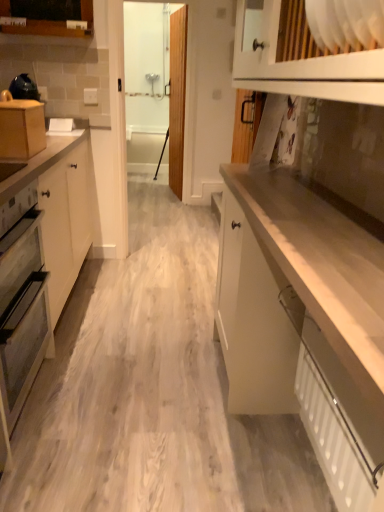
Locate an element on the screen. matte wood box at left, which is the second cabinetry in left-to-right order is located at coordinates (21, 129).

Find the location of a particular element. transparent glass door at upper center is located at coordinates (176, 95).

Identify the location of matte wood box at left, which is counted as the second cabinetry, starting from the right. Image resolution: width=384 pixels, height=512 pixels. (21, 129).

Is point (335, 329) farther from camera compared to point (14, 322)?

That is False.

Is white matte cabinet at center, positioned as the third cabinetry in left-to-right order, taller or shorter than matte gray oven at left?

In the image, white matte cabinet at center, positioned as the third cabinetry in left-to-right order, appears to be shorter than matte gray oven at left.

Can you tell me how much white matte cabinet at center, positioned as the first cabinetry in front-to-back order, and matte gray oven at left differ in facing direction?

They differ by 180 degrees in their facing directions.

From a real-world perspective, is white matte cabinet at center, the 3th cabinetry viewed from the back, physically above white textured radiator at lower right?

Yes, from a real-world perspective, white matte cabinet at center, the 3th cabinetry viewed from the back, is above white textured radiator at lower right.

Would you say white matte cabinet at center, the 3th cabinetry from the top, is to the left or to the right of white textured radiator at lower right in the picture?

white matte cabinet at center, the 3th cabinetry from the top, is to the left of white textured radiator at lower right.

Locate an element on the screen. radiator that appears below the white matte cabinet at center, positioned as the first cabinetry in front-to-back order (from a real-world perspective) is located at coordinates (338, 435).

Is white matte cabinet at center, the 3th cabinetry viewed from the back, at the left side of wooden cabinet at upper left, which is the 1th cabinetry from top to bottom?

Incorrect, white matte cabinet at center, the 3th cabinetry viewed from the back, is not on the left side of wooden cabinet at upper left, which is the 1th cabinetry from top to bottom.

Which object is wider, white matte cabinet at center, marked as the 1th cabinetry in a bottom-to-top arrangement, or wooden cabinet at upper left, the first cabinetry from the left?

With larger width is white matte cabinet at center, marked as the 1th cabinetry in a bottom-to-top arrangement.

Could you measure the distance between white matte cabinet at center, the first cabinetry in the right-to-left sequence, and wooden cabinet at upper left, the first cabinetry from the left?

A distance of 6.48 feet exists between white matte cabinet at center, the first cabinetry in the right-to-left sequence, and wooden cabinet at upper left, the first cabinetry from the left.

How different are the orientations of white textured radiator at lower right and wooden cabinet at upper left, which is the 1th cabinetry from top to bottom, in degrees?

white textured radiator at lower right and wooden cabinet at upper left, which is the 1th cabinetry from top to bottom, are facing 88.2 degrees away from each other.

From a real-world perspective, which object stands above the other?

wooden cabinet at upper left, the first cabinetry from the left, is physically above.

Is white textured radiator at lower right turned away from wooden cabinet at upper left, which is counted as the third cabinetry, starting from the right?

No, white textured radiator at lower right is not facing the opposite direction of wooden cabinet at upper left, which is counted as the third cabinetry, starting from the right.

Where is `the 3rd cabinetry above the white textured radiator at lower right (from the image's perspective)`? the 3rd cabinetry above the white textured radiator at lower right (from the image's perspective) is located at coordinates (47, 17).

From a real-world perspective, is white textured radiator at lower right on matte wood box at left, marked as the second cabinetry in a top-to-bottom arrangement?

No, from a real-world perspective, white textured radiator at lower right is not over matte wood box at left, marked as the second cabinetry in a top-to-bottom arrangement

Looking at this image, is white textured radiator at lower right turned away from matte wood box at left, which appears as the 2th cabinetry when viewed from the back?

white textured radiator at lower right does not have its back to matte wood box at left, which appears as the 2th cabinetry when viewed from the back.

Is white textured radiator at lower right bigger than matte wood box at left, marked as the second cabinetry in a top-to-bottom arrangement?

Yes.

In the scene shown: From the image's perspective, which is below, white textured radiator at lower right or matte wood box at left, which appears as the 2th cabinetry when viewed from the back?

white textured radiator at lower right.

From a real-world perspective, is wooden cabinet at upper left, which is counted as the third cabinetry, starting from the right, positioned over matte gray oven at left based on gravity?

Yes, from a real-world perspective, wooden cabinet at upper left, which is counted as the third cabinetry, starting from the right, is over matte gray oven at left

Considering the sizes of wooden cabinet at upper left, which is the 1th cabinetry from top to bottom, and matte gray oven at left in the image, is wooden cabinet at upper left, which is the 1th cabinetry from top to bottom, wider or thinner than matte gray oven at left?

wooden cabinet at upper left, which is the 1th cabinetry from top to bottom, is thinner than matte gray oven at left.

Is matte gray oven at left at the back of wooden cabinet at upper left, which is counted as the third cabinetry, starting from the right?

No, wooden cabinet at upper left, which is counted as the third cabinetry, starting from the right, is not facing away from matte gray oven at left.

From the image's perspective, would you say wooden cabinet at upper left, the first cabinetry from the left, is shown under matte gray oven at left?

No, from the image's perspective, wooden cabinet at upper left, the first cabinetry from the left, is not beneath matte gray oven at left.

You are a GUI agent. You are given a task and a screenshot of the screen. Output one action in this format:
    pyautogui.click(x=<x>, y=<y>)
    Task: Click on the radiator below the wooden cabinet at upper left, the third cabinetry in the front-to-back sequence (from the image's perspective)
    The height and width of the screenshot is (512, 384).
    Given the screenshot: What is the action you would take?
    pyautogui.click(x=338, y=435)

Considering the relative sizes of wooden cabinet at upper left, the 1th cabinetry viewed from the back, and white textured radiator at lower right in the image provided, is wooden cabinet at upper left, the 1th cabinetry viewed from the back, thinner than white textured radiator at lower right?

Incorrect, the width of wooden cabinet at upper left, the 1th cabinetry viewed from the back, is not less than that of white textured radiator at lower right.

Which of these two, wooden cabinet at upper left, the third cabinetry in the front-to-back sequence, or white textured radiator at lower right, is bigger?

white textured radiator at lower right is bigger.

From a real-world perspective, is wooden cabinet at upper left, the 1th cabinetry viewed from the back, on top of white textured radiator at lower right?

Yes.

You are a GUI agent. You are given a task and a screenshot of the screen. Output one action in this format:
    pyautogui.click(x=<x>, y=<y>)
    Task: Click on the home appliance above the white matte cabinet at center, marked as the 1th cabinetry in a bottom-to-top arrangement (from a real-world perspective)
    The width and height of the screenshot is (384, 512).
    Given the screenshot: What is the action you would take?
    pyautogui.click(x=22, y=302)

Where is `radiator that is under the white matte cabinet at center, the 3th cabinetry from the top (from a real-world perspective)`? This screenshot has width=384, height=512. radiator that is under the white matte cabinet at center, the 3th cabinetry from the top (from a real-world perspective) is located at coordinates (338, 435).

Based on their spatial positions, is wooden cabinet at upper left, the third cabinetry in the front-to-back sequence, or matte gray oven at left closer to white matte cabinet at center, the 3th cabinetry viewed from the back?

Among the two, matte gray oven at left is located nearer to white matte cabinet at center, the 3th cabinetry viewed from the back.

When comparing their distances from matte gray oven at left, does white textured radiator at lower right or transparent glass door at upper center seem further?

transparent glass door at upper center is positioned further to the anchor matte gray oven at left.

Estimate the real-world distances between objects in this image. Which object is further from white matte cabinet at center, positioned as the first cabinetry in front-to-back order, transparent glass door at upper center or wooden cabinet at upper left, the third cabinetry in the front-to-back sequence?

transparent glass door at upper center.

Consider the image. When comparing their distances from white matte cabinet at center, the first cabinetry in the right-to-left sequence, does matte wood box at left, marked as the second cabinetry in a top-to-bottom arrangement, or wooden cabinet at upper left, the third cabinetry in the front-to-back sequence, seem further?

wooden cabinet at upper left, the third cabinetry in the front-to-back sequence.

Consider the image. Considering their positions, is matte wood box at left, which appears as the 2th cabinetry when viewed from the back, positioned further to wooden cabinet at upper left, which is counted as the third cabinetry, starting from the right, than transparent glass door at upper center?

transparent glass door at upper center is further to wooden cabinet at upper left, which is counted as the third cabinetry, starting from the right.

Considering their positions, is white textured radiator at lower right positioned further to wooden cabinet at upper left, which is the 1th cabinetry from top to bottom, than matte wood box at left, which appears as the 2th cabinetry when viewed from the back?

white textured radiator at lower right.

From the image, which object appears to be farther from wooden cabinet at upper left, the 1th cabinetry viewed from the back, white textured radiator at lower right or transparent glass door at upper center?

Among the two, white textured radiator at lower right is located further to wooden cabinet at upper left, the 1th cabinetry viewed from the back.

Which object lies nearer to the anchor point transparent glass door at upper center, wooden cabinet at upper left, which is counted as the 3th cabinetry, starting from the bottom, or white matte cabinet at center, marked as the 1th cabinetry in a bottom-to-top arrangement?

wooden cabinet at upper left, which is counted as the 3th cabinetry, starting from the bottom, is closer to transparent glass door at upper center.

Find the location of `home appliance between wooden cabinet at upper left, the third cabinetry in the front-to-back sequence, and white textured radiator at lower right vertically`. home appliance between wooden cabinet at upper left, the third cabinetry in the front-to-back sequence, and white textured radiator at lower right vertically is located at coordinates (22, 302).

The image size is (384, 512). I want to click on home appliance between white matte cabinet at center, the first cabinetry in the right-to-left sequence, and wooden cabinet at upper left, the first cabinetry from the left, from front to back, so click(x=22, y=302).

Where is `home appliance between matte wood box at left, which is counted as the second cabinetry, starting from the front, and white textured radiator at lower right, in the horizontal direction`? Image resolution: width=384 pixels, height=512 pixels. home appliance between matte wood box at left, which is counted as the second cabinetry, starting from the front, and white textured radiator at lower right, in the horizontal direction is located at coordinates (22, 302).

You are a GUI agent. You are given a task and a screenshot of the screen. Output one action in this format:
    pyautogui.click(x=<x>, y=<y>)
    Task: Click on the home appliance located between white textured radiator at lower right and transparent glass door at upper center in the depth direction
    The height and width of the screenshot is (512, 384).
    Given the screenshot: What is the action you would take?
    pos(22,302)